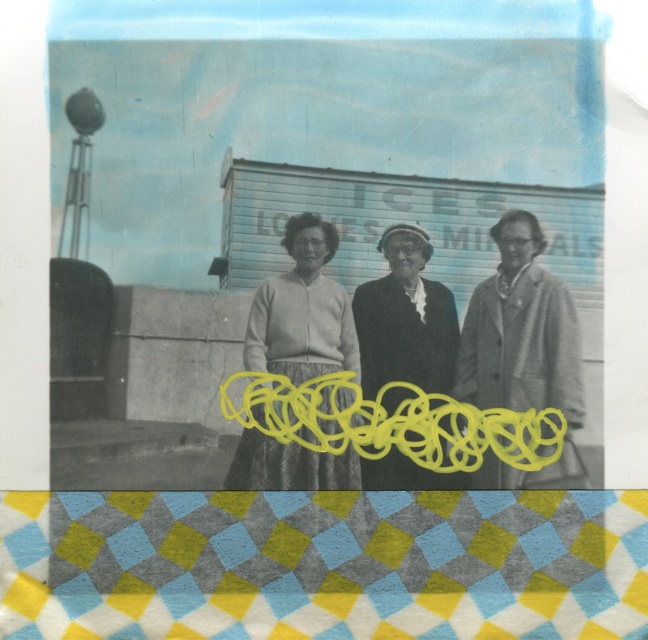
Does point (469, 324) come farther from viewer compared to point (248, 323)?

That is True.

Which of these two, light gray wool coat at center or knitted sweater at center, stands taller?

light gray wool coat at center

Does point (465, 353) come behind point (281, 275)?

No, (465, 353) is in front of (281, 275).

You are a GUI agent. You are given a task and a screenshot of the screen. Output one action in this format:
    pyautogui.click(x=<x>, y=<y>)
    Task: Click on the light gray wool coat at center
    
    Given the screenshot: What is the action you would take?
    pyautogui.click(x=522, y=349)

Does light gray wool coat at center have a smaller size compared to smooth black coat at center?

No.

Is point (496, 381) farther from camera compared to point (441, 358)?

No, (496, 381) is in front of (441, 358).

You are a GUI agent. You are given a task and a screenshot of the screen. Output one action in this format:
    pyautogui.click(x=<x>, y=<y>)
    Task: Click on the light gray wool coat at center
    Image resolution: width=648 pixels, height=640 pixels.
    Given the screenshot: What is the action you would take?
    pyautogui.click(x=522, y=349)

Is point (332, 342) farther from camera compared to point (432, 358)?

Yes, point (332, 342) is behind point (432, 358).

Is knitted sweater at center further to camera compared to smooth black coat at center?

No, it is in front of smooth black coat at center.

Between point (330, 301) and point (386, 292), which one is positioned in front?

Point (330, 301) is in front.

Where is `knitted sweater at center`? The image size is (648, 640). knitted sweater at center is located at coordinates (303, 310).